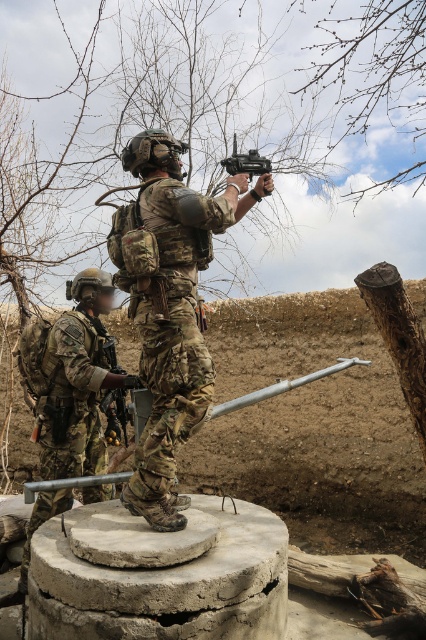
You are a military analyst assessing the image of two soldiers in a combat scenario. Based on the positions of the camouflage uniform at left and the matte black toy gun at center, which object is positioned lower in the image?

The camouflage uniform at left is positioned lower than the matte black toy gun at center in the image.

You are a military medic trying to reach both soldiers. The first is wearing a camouflage uniform at center, and the second is wearing a camouflage uniform at left. If you need to provide immediate medical assistance, which soldier should you prioritize based on their proximity to you?

The camouflage uniform at center is closer, being only 38.97 inches away from the camouflage uniform at left. Therefore, you should prioritize assisting the soldier in the camouflage uniform at center first.

You are a military analyst assessing the image. Based on the positions of the camouflage uniform at center and the matte black toy gun at center, which object is positioned lower in the scene?

The camouflage uniform at center is located below matte black toy gun at center, so the camouflage uniform at center is positioned lower in the scene.